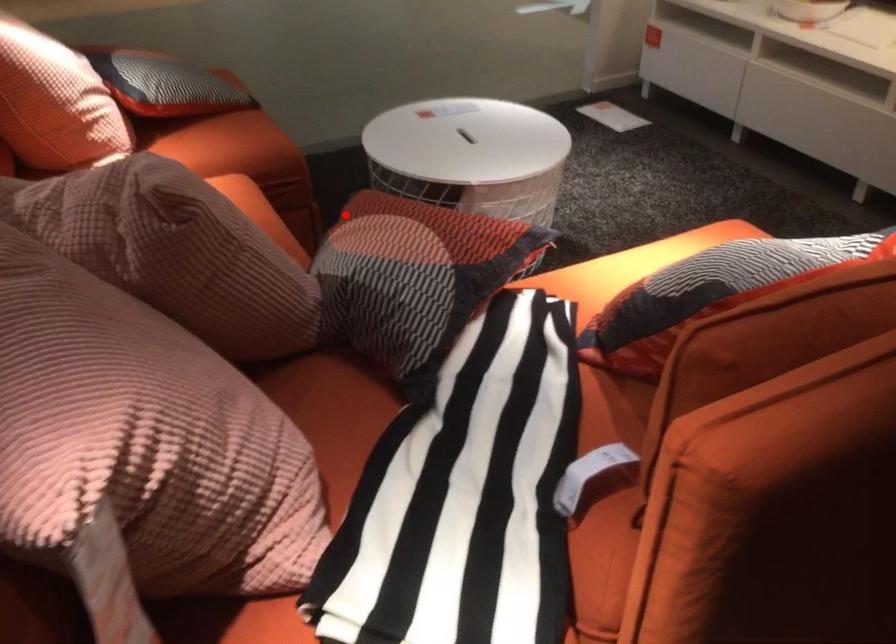
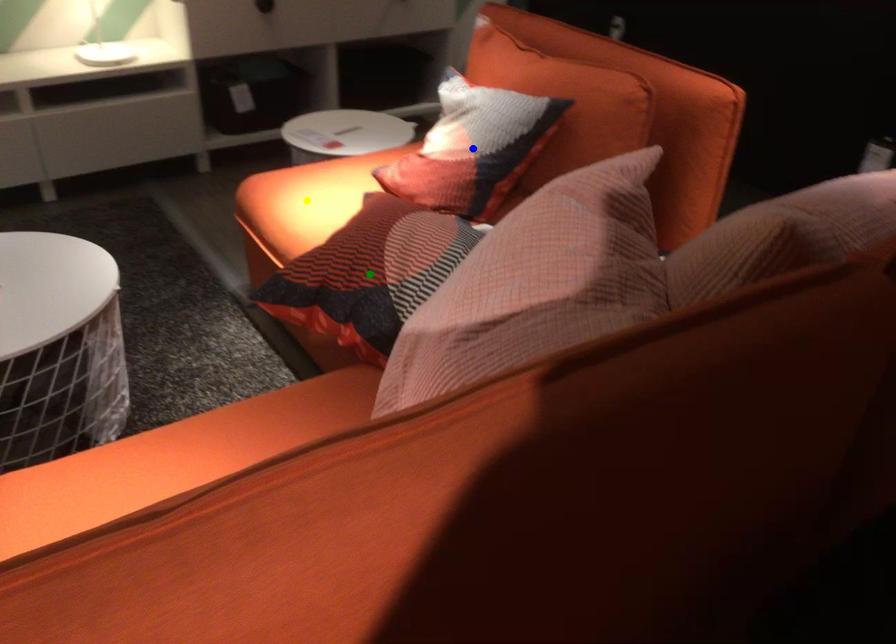
Question: I am providing you with two images of the same scene from different viewpoints. A red point is marked on the first image. You are given multiple points on the second image. Which mark in image 2 goes with the point in image 1?

Choices:
 (A) green point
 (B) yellow point
 (C) blue point

Answer: (A)